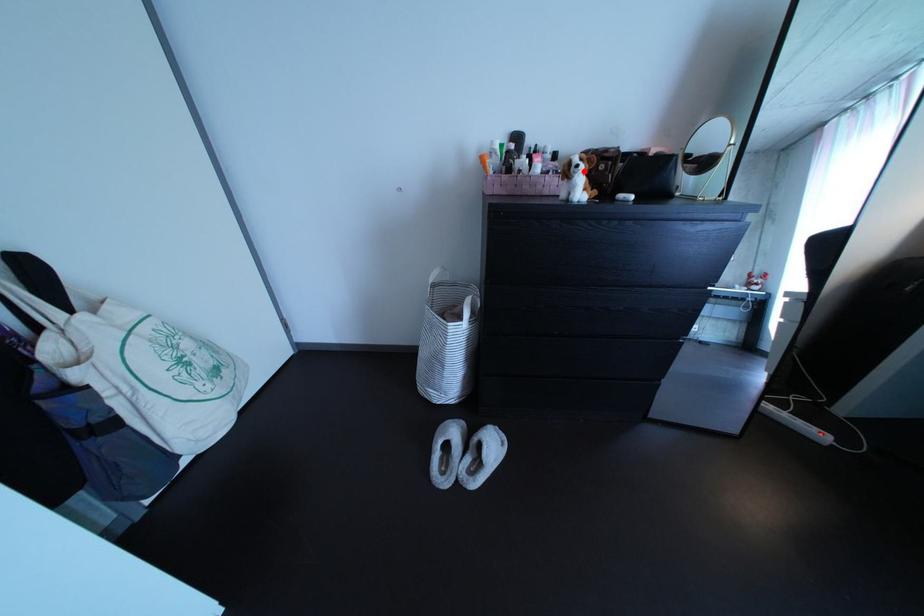
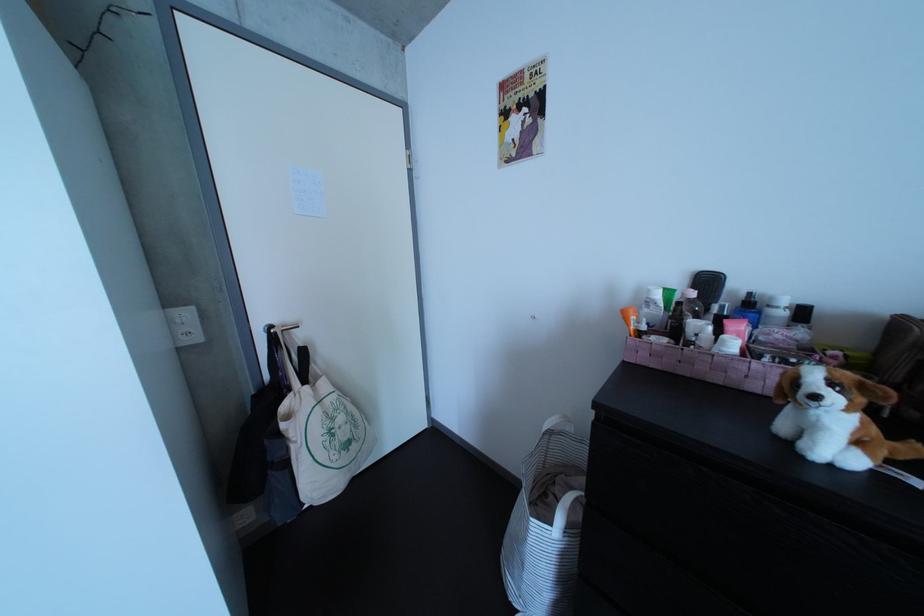
Where in the second image is the point corresponding to the highlighted location from the first image?

(809, 389)